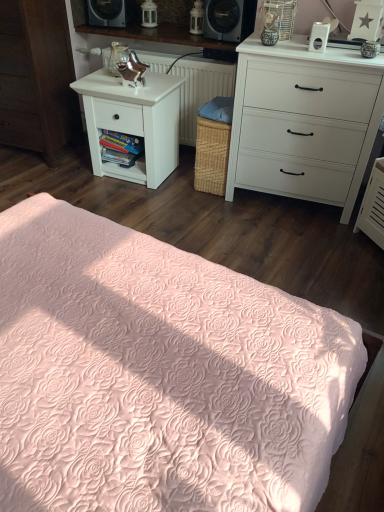
Question: From the image's perspective, does white matte nightstand at left appear higher than white textured radiator at center?

Choices:
 (A) no
 (B) yes

Answer: (A)

Question: From the image's perspective, is white matte nightstand at left located beneath white textured radiator at center?

Choices:
 (A) no
 (B) yes

Answer: (B)

Question: Can you confirm if white matte nightstand at left is bigger than white textured radiator at center?

Choices:
 (A) no
 (B) yes

Answer: (A)

Question: Considering the relative sizes of white matte nightstand at left and white textured radiator at center in the image provided, is white matte nightstand at left thinner than white textured radiator at center?

Choices:
 (A) no
 (B) yes

Answer: (B)

Question: Does white matte nightstand at left have a greater width compared to white textured radiator at center?

Choices:
 (A) no
 (B) yes

Answer: (A)

Question: From their relative heights in the image, would you say white matte nightstand at left is taller or shorter than pink quilted bedspread at lower center?

Choices:
 (A) tall
 (B) short

Answer: (B)

Question: From the image's perspective, is white matte nightstand at left located above or below pink quilted bedspread at lower center?

Choices:
 (A) above
 (B) below

Answer: (A)

Question: Is point (157, 112) closer or farther from the camera than point (246, 330)?

Choices:
 (A) closer
 (B) farther

Answer: (B)

Question: Looking at their shapes, would you say white matte nightstand at left is wider or thinner than pink quilted bedspread at lower center?

Choices:
 (A) wide
 (B) thin

Answer: (B)

Question: Does point (170, 79) appear closer or farther from the camera than point (246, 162)?

Choices:
 (A) farther
 (B) closer

Answer: (A)

Question: From a real-world perspective, relative to white matte chest of drawers at upper right, is white matte nightstand at left vertically above or below?

Choices:
 (A) above
 (B) below

Answer: (B)

Question: Considering the positions of white matte nightstand at left and white matte chest of drawers at upper right in the image, is white matte nightstand at left bigger or smaller than white matte chest of drawers at upper right?

Choices:
 (A) small
 (B) big

Answer: (A)

Question: In terms of width, does white matte nightstand at left look wider or thinner when compared to white matte chest of drawers at upper right?

Choices:
 (A) thin
 (B) wide

Answer: (A)

Question: Do you think white matte nightstand at left is within white textured radiator at center, or outside of it?

Choices:
 (A) inside
 (B) outside

Answer: (B)

Question: From a real-world perspective, is white matte nightstand at left above or below white textured radiator at center?

Choices:
 (A) below
 (B) above

Answer: (A)